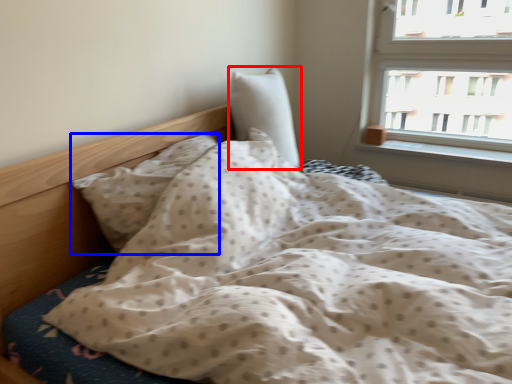
Question: Which object is closer to the camera taking this photo, pillow (highlighted by a red box) or pillow (highlighted by a blue box)?

Choices:
 (A) pillow
 (B) pillow

Answer: (B)